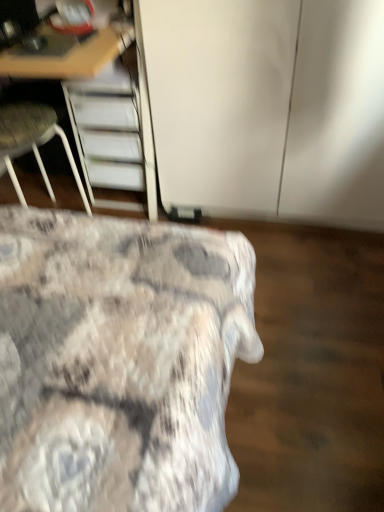
Question: Is wooden desk at upper left smaller than white glossy cabinet at upper center?

Choices:
 (A) no
 (B) yes

Answer: (A)

Question: From the image's perspective, is wooden desk at upper left on top of white glossy cabinet at upper center?

Choices:
 (A) no
 (B) yes

Answer: (B)

Question: From a real-world perspective, is wooden desk at upper left below white glossy cabinet at upper center?

Choices:
 (A) yes
 (B) no

Answer: (B)

Question: From a real-world perspective, does wooden desk at upper left stand above white glossy cabinet at upper center?

Choices:
 (A) no
 (B) yes

Answer: (B)

Question: Is wooden desk at upper left bigger than white glossy cabinet at upper center?

Choices:
 (A) yes
 (B) no

Answer: (A)

Question: Looking at their shapes, would you say wooden desk at upper left is wider or thinner than textured fabric bed at lower left?

Choices:
 (A) thin
 (B) wide

Answer: (A)

Question: Relative to textured fabric bed at lower left, is wooden desk at upper left in front or behind?

Choices:
 (A) behind
 (B) front

Answer: (A)

Question: From a real-world perspective, is wooden desk at upper left physically located above or below textured fabric bed at lower left?

Choices:
 (A) below
 (B) above

Answer: (B)

Question: Considering the positions of wooden desk at upper left and textured fabric bed at lower left in the image, is wooden desk at upper left taller or shorter than textured fabric bed at lower left?

Choices:
 (A) tall
 (B) short

Answer: (A)

Question: In the image, is wooden desk at upper left on the left side or the right side of white glossy cabinet at upper center?

Choices:
 (A) right
 (B) left

Answer: (B)

Question: Is point (66, 64) positioned closer to the camera than point (349, 179)?

Choices:
 (A) closer
 (B) farther

Answer: (A)

Question: Would you say wooden desk at upper left is inside or outside white glossy cabinet at upper center?

Choices:
 (A) inside
 (B) outside

Answer: (B)

Question: Based on their sizes in the image, would you say wooden desk at upper left is bigger or smaller than white glossy cabinet at upper center?

Choices:
 (A) small
 (B) big

Answer: (B)

Question: Relative to wooden desk at upper left, is white glossy cabinet at upper center in front or behind?

Choices:
 (A) behind
 (B) front

Answer: (A)

Question: Based on their sizes in the image, would you say white glossy cabinet at upper center is bigger or smaller than wooden desk at upper left?

Choices:
 (A) small
 (B) big

Answer: (A)